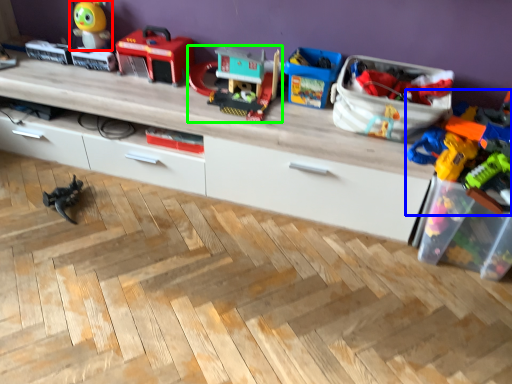
Question: Estimate the real-world distances between objects in this image. Which object is farther from toy (highlighted by a red box), toy (highlighted by a blue box) or toy (highlighted by a green box)?

Choices:
 (A) toy
 (B) toy

Answer: (A)